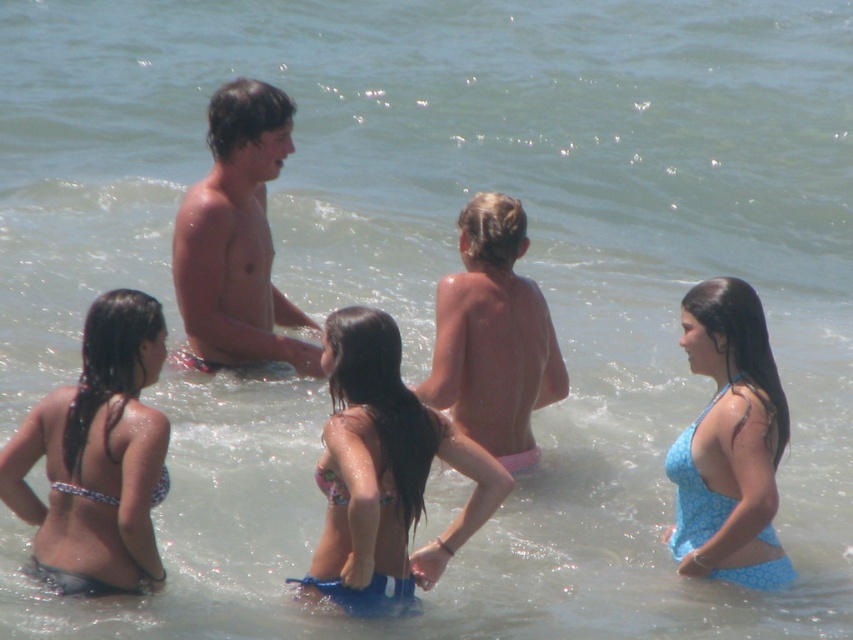
You are a photographer trying to capture a clear photo of the pink fabric boy at center without the blue printed swimsuit at center blocking the view. Based on their positions, is this possible?

The blue printed swimsuit at center is in front of the pink fabric boy at center, so the photographer cannot capture a clear photo of the pink fabric boy at center without the blue printed swimsuit at center blocking the view.